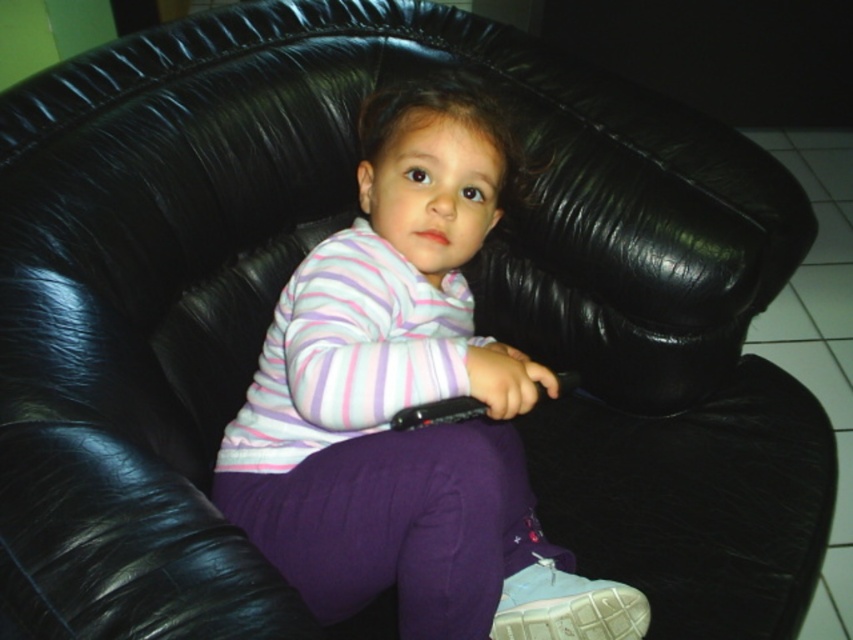
Question: Can you confirm if striped cotton shirt at center is positioned to the left of light blue fabric shoe at lower center?

Choices:
 (A) no
 (B) yes

Answer: (B)

Question: Which point is farther from the camera taking this photo?

Choices:
 (A) (554, 636)
 (B) (483, 106)

Answer: (B)

Question: Which object appears farthest from the camera in this image?

Choices:
 (A) light blue fabric shoe at lower center
 (B) striped cotton shirt at center

Answer: (A)

Question: Is striped cotton shirt at center bigger than light blue fabric shoe at lower center?

Choices:
 (A) yes
 (B) no

Answer: (A)

Question: Does striped cotton shirt at center come in front of light blue fabric shoe at lower center?

Choices:
 (A) no
 (B) yes

Answer: (B)

Question: Which of the following is the closest to the observer?

Choices:
 (A) light blue fabric shoe at lower center
 (B) striped cotton shirt at center

Answer: (B)